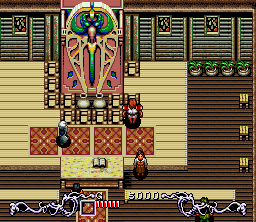
You are a GUI agent. You are given a task and a screenshot of the screen. Output one action in this format:
    pyautogui.click(x=<x>, y=<y>)
    Task: Click on the table
    Image resolution: width=256 pixels, height=222 pixels.
    Given the screenshot: What is the action you would take?
    click(63, 165)